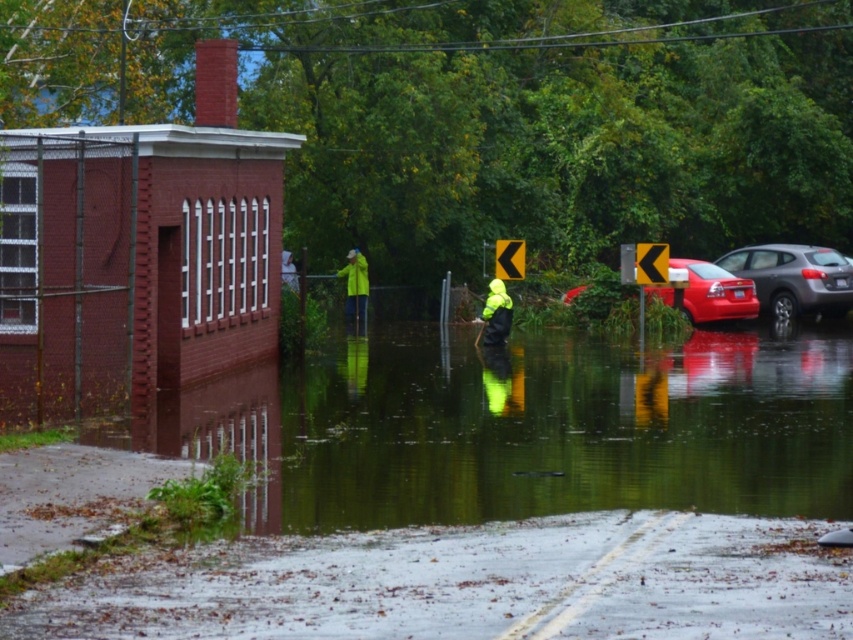
Can you confirm if yellow matte jacket at center is positioned above high-visibility yellow safety vest at center?

No.

Can you confirm if yellow matte jacket at center is thinner than high-visibility yellow safety vest at center?

Yes, yellow matte jacket at center is thinner than high-visibility yellow safety vest at center.

Measure the distance between yellow matte jacket at center and camera.

yellow matte jacket at center and camera are 32.71 meters apart.

I want to click on yellow matte jacket at center, so click(496, 314).

Between green reflective water at center and yellow waterproof jacket at center, which one is positioned lower?

green reflective water at center is below.

Describe the element at coordinates (524, 428) in the screenshot. The width and height of the screenshot is (853, 640). I see `green reflective water at center` at that location.

What are the coordinates of `green reflective water at center` in the screenshot? It's located at (524, 428).

The width and height of the screenshot is (853, 640). I want to click on green reflective water at center, so 524,428.

Does green reflective water at center appear under high-visibility yellow safety vest at center?

Yes, green reflective water at center is below high-visibility yellow safety vest at center.

How distant is green reflective water at center from high-visibility yellow safety vest at center?

green reflective water at center is 6.52 meters away from high-visibility yellow safety vest at center.

Is point (450, 490) farther from camera compared to point (490, 305)?

No, (450, 490) is closer to viewer.

This screenshot has width=853, height=640. In order to click on green reflective water at center in this screenshot , I will do `click(524, 428)`.